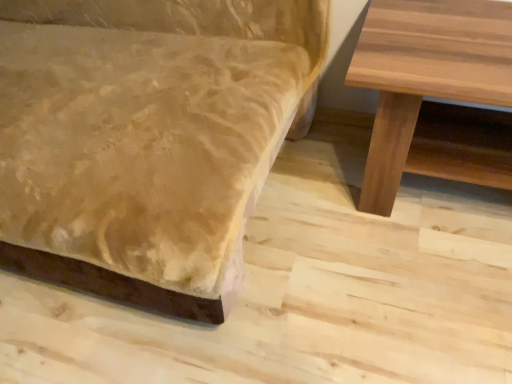
Image resolution: width=512 pixels, height=384 pixels. Identify the location of vacant area on top of natural wood table at right (from a real-world perspective). (449, 36).